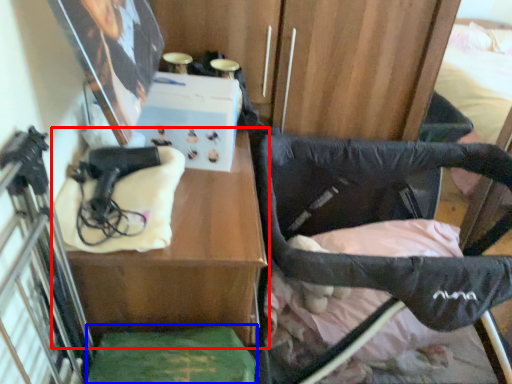
Question: Which of the following is the closest to the observer, table (highlighted by a red box) or wide (highlighted by a blue box)?

Choices:
 (A) table
 (B) wide

Answer: (B)